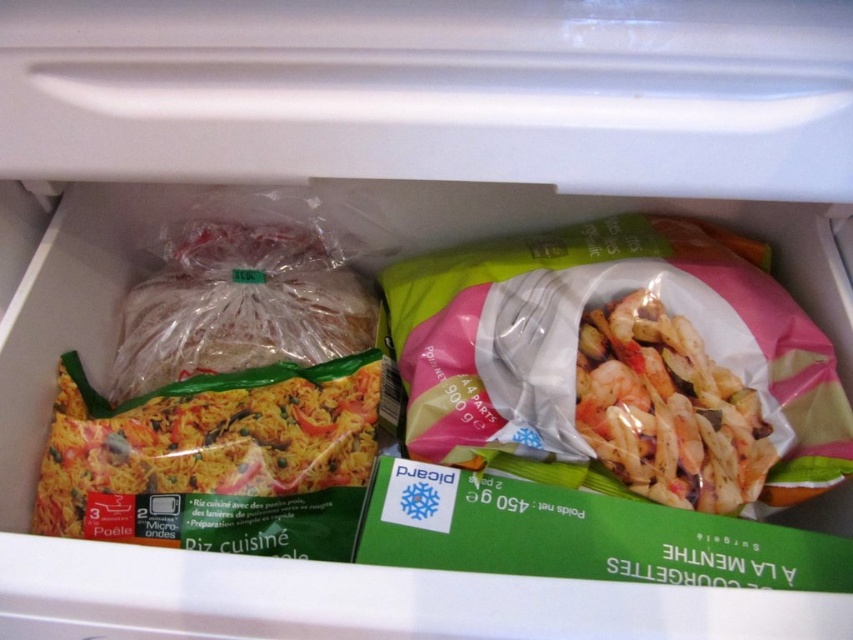
You are organizing the refrigerator drawer and need to stack items vertically. The drawer has limited vertical space. You have a translucent plastic bag of rice at center and a pink matte shrimp at center. Which item should you place at the bottom to ensure both items fit without exceeding the drawer height?

You should place the translucent plastic bag of rice at center at the bottom because it is taller than the pink matte shrimp at center, allowing the shorter shrimp to be placed on top without exceeding the drawer height.

You are organizing the refrigerator drawer and notice the pink plastic bag of shrimp at center and the green matte rice at center. Which item is placed above the other?

The pink plastic bag of shrimp at center is positioned over the green matte rice at center, so the shrimp bag is above the rice.